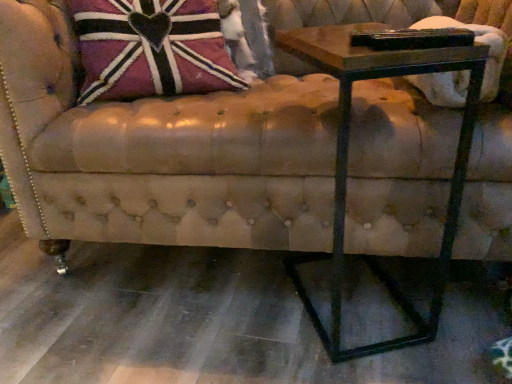
I want to click on free space to the left of wooden table at right, so click(240, 306).